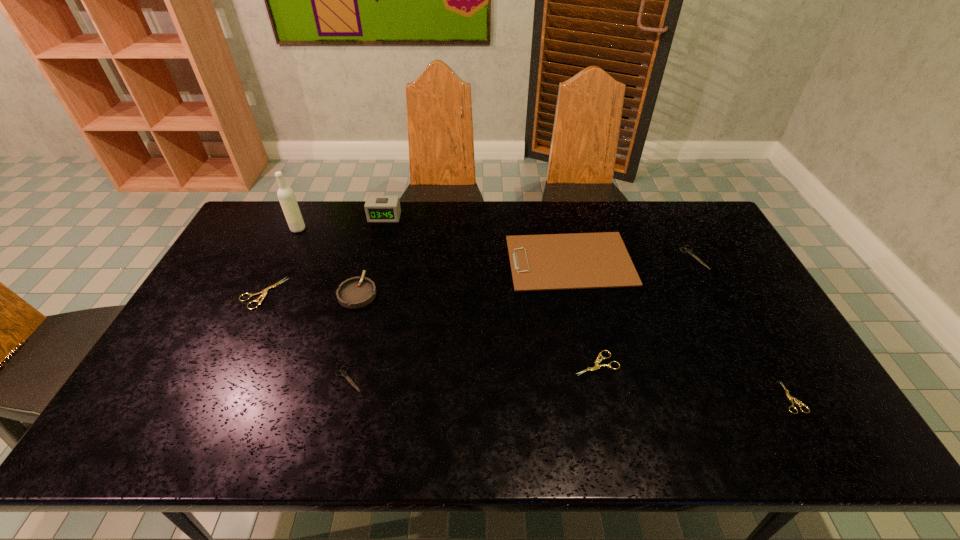
The image size is (960, 540). What are the coordinates of `vacant area that lies between the leftmost shears and the second biggest beige shears` in the screenshot? It's located at (429, 328).

Find the location of a particular element. The height and width of the screenshot is (540, 960). free spot between the rightmost shears and the vodka is located at coordinates (544, 313).

Where is `vacant space in between the smaller black shears and the second beige shears from right to left`? This screenshot has height=540, width=960. vacant space in between the smaller black shears and the second beige shears from right to left is located at coordinates (472, 371).

In order to click on free space between the second beige shears from right to left and the smaller black shears in this screenshot , I will do `click(472, 371)`.

You are a GUI agent. You are given a task and a screenshot of the screen. Output one action in this format:
    pyautogui.click(x=<x>, y=<y>)
    Task: Click on the free space between the alarm clock and the smallest beige shears
    
    Given the screenshot: What is the action you would take?
    pyautogui.click(x=588, y=307)

Image resolution: width=960 pixels, height=540 pixels. I want to click on vacant space in between the bigger black shears and the second beige shears from right to left, so click(645, 310).

Identify the location of free space between the second biggest beige shears and the nearer black shears. The height and width of the screenshot is (540, 960). (472, 371).

Locate an element on the screen. The width and height of the screenshot is (960, 540). empty location between the tallest object and the clipboard is located at coordinates (434, 245).

The width and height of the screenshot is (960, 540). I want to click on the sixth closest object to the alarm clock, so click(x=597, y=361).

At what (x,y) coordinates should I click in order to perform the action: click on object identified as the third closest to the farthest object. Please return your answer as a coordinate pair (x, y). This screenshot has height=540, width=960. Looking at the image, I should click on (264, 293).